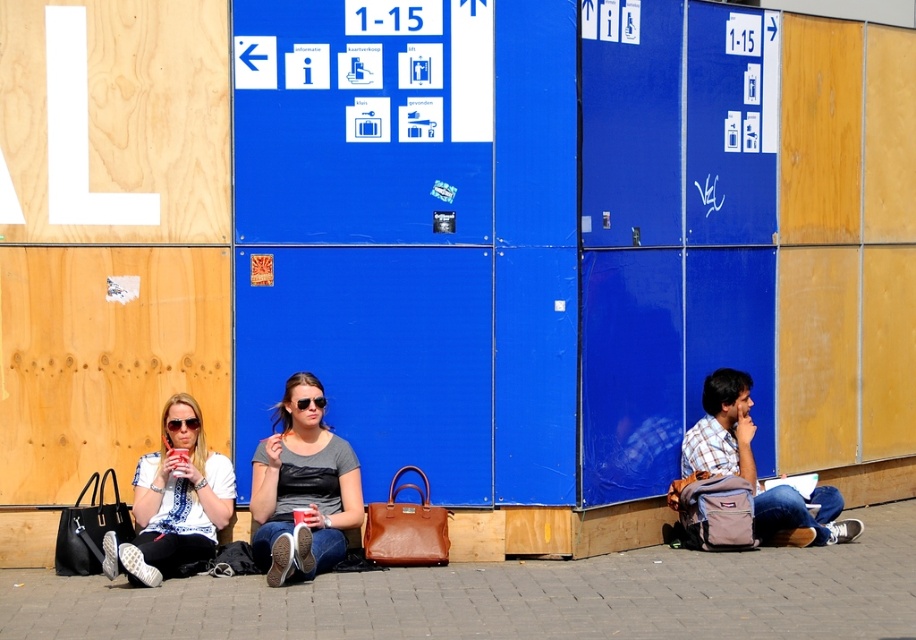
Can you confirm if matte black sunglasses at center is shorter than matte white sunglasses at left?

No, matte black sunglasses at center is not shorter than matte white sunglasses at left.

Is matte black sunglasses at center smaller than matte white sunglasses at left?

No.

Is point (330, 476) closer to viewer compared to point (186, 474)?

No, it is behind (186, 474).

Identify the location of matte black sunglasses at center. This screenshot has height=640, width=916. (304, 486).

Which is below, matte black sunglasses at center or plaid cotton shirt at lower right?

matte black sunglasses at center is lower down.

Between matte black sunglasses at center and plaid cotton shirt at lower right, which one has more height?

With more height is matte black sunglasses at center.

You are a GUI agent. You are given a task and a screenshot of the screen. Output one action in this format:
    pyautogui.click(x=<x>, y=<y>)
    Task: Click on the matte black sunglasses at center
    Image resolution: width=916 pixels, height=640 pixels.
    Given the screenshot: What is the action you would take?
    pyautogui.click(x=304, y=486)

Is smooth concrete pavement at center positioned behind matte white sunglasses at left?

No, it is not.

Who is positioned more to the right, smooth concrete pavement at center or matte white sunglasses at left?

smooth concrete pavement at center

Describe the element at coordinates (511, 596) in the screenshot. Image resolution: width=916 pixels, height=640 pixels. I see `smooth concrete pavement at center` at that location.

Locate an element on the screen. The height and width of the screenshot is (640, 916). smooth concrete pavement at center is located at coordinates (511, 596).